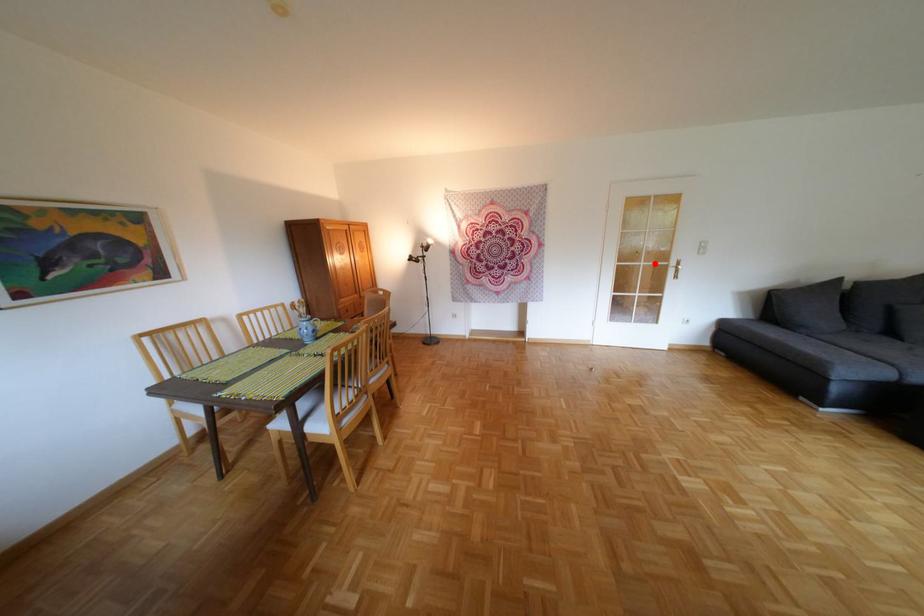
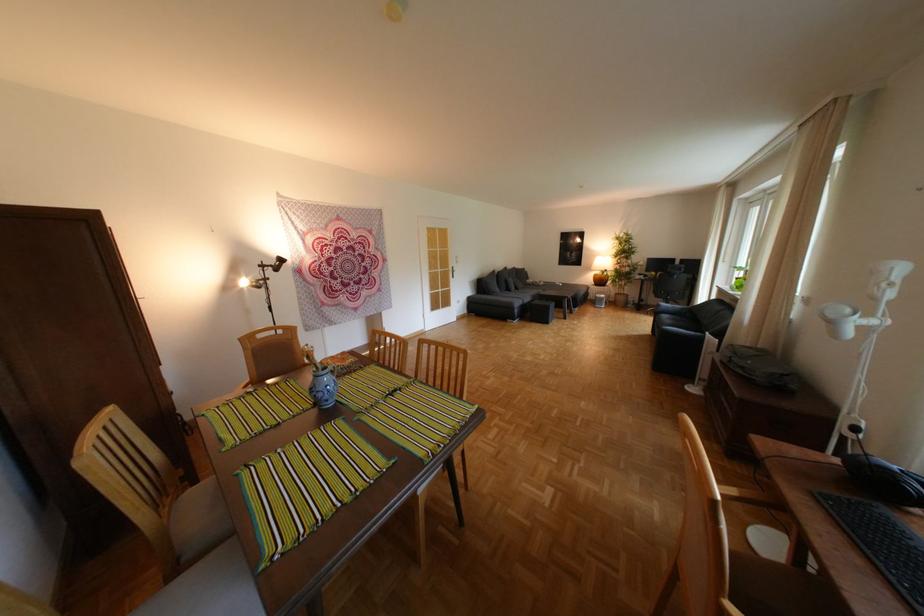
Question: A red point is marked in image1. In image2, is the corresponding 3D point closer to the camera or farther? Reply with the corresponding letter.

Choices:
 (A) The corresponding 3D point is closer.
 (B) The corresponding 3D point is farther.

Answer: (A)